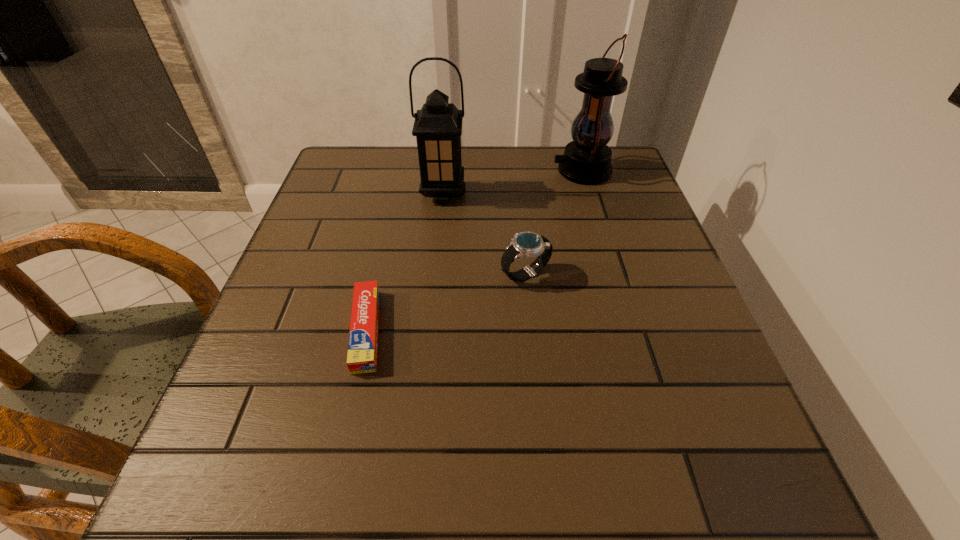
Find the location of `vacant area between the nearest object and the third object from right to left`. vacant area between the nearest object and the third object from right to left is located at coordinates (405, 262).

Where is `free space that is in between the left lantern and the nearest object`? The height and width of the screenshot is (540, 960). free space that is in between the left lantern and the nearest object is located at coordinates pyautogui.click(x=405, y=262).

The width and height of the screenshot is (960, 540). Identify the location of vacant area that lies between the third farthest object and the second object from left to right. (484, 234).

Where is `vacant space that is in between the left lantern and the shortest object`? The height and width of the screenshot is (540, 960). vacant space that is in between the left lantern and the shortest object is located at coordinates (405, 262).

Identify the location of unoccupied position between the nearest object and the rightmost object. The height and width of the screenshot is (540, 960). (474, 251).

Where is `unoccupied position between the third object from right to left and the second object from right to left`? The height and width of the screenshot is (540, 960). unoccupied position between the third object from right to left and the second object from right to left is located at coordinates click(484, 234).

The width and height of the screenshot is (960, 540). Identify the location of free space between the shortest object and the rightmost object. (474, 251).

Find the location of a particular element. This screenshot has width=960, height=540. blank region between the rightmost object and the second object from right to left is located at coordinates (554, 222).

Identify the location of empty location between the second object from right to left and the shortest object. Image resolution: width=960 pixels, height=540 pixels. (445, 302).

Identify which object is located as the third nearest to the right lantern. Please provide its 2D coordinates. Your answer should be formatted as a tuple, i.e. [(x, y)], where the tuple contains the x and y coordinates of a point satisfying the conditions above.

[(363, 338)]